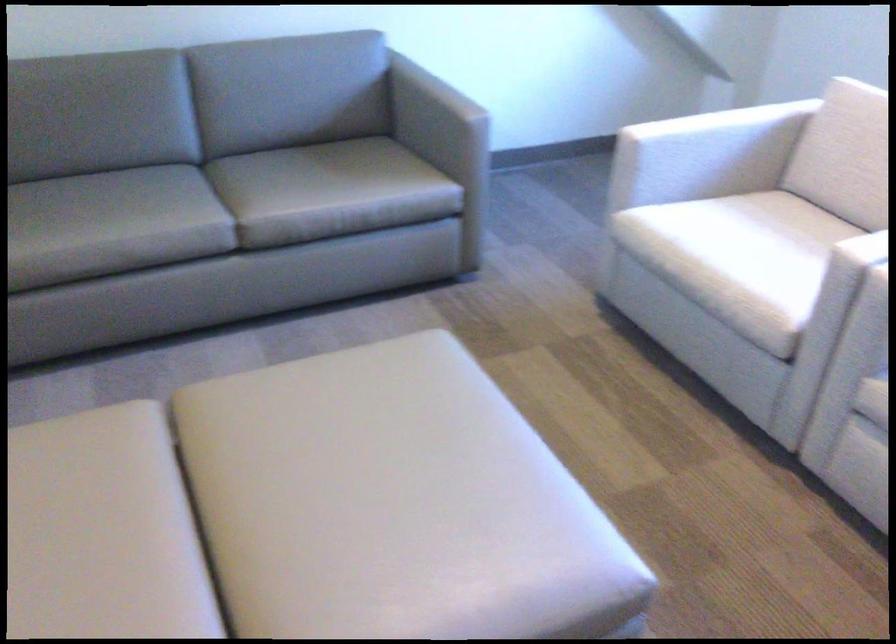
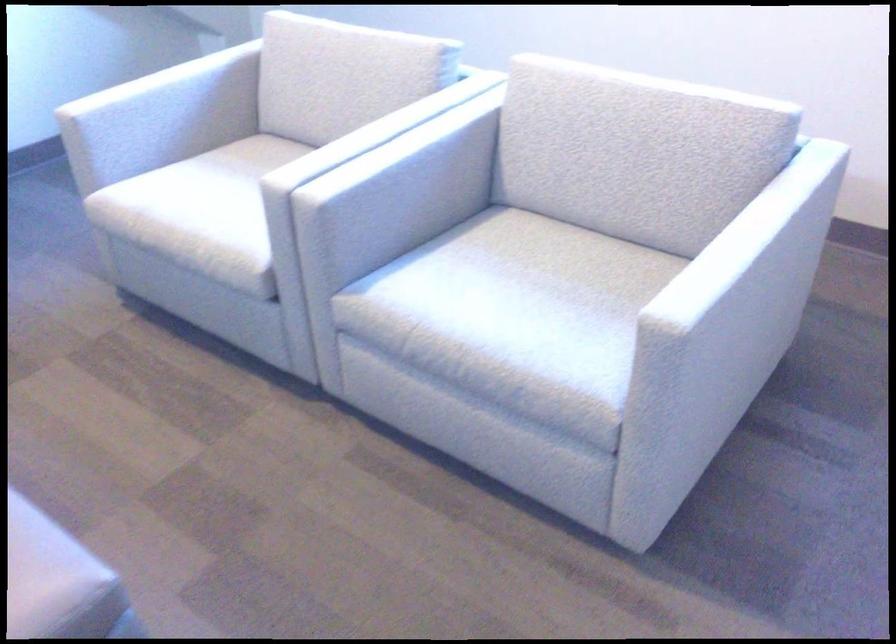
Question: The first image is from the beginning of the video and the second image is from the end. How did the camera likely rotate when shooting the video?

Choices:
 (A) Left
 (B) Right
 (C) Up
 (D) Down

Answer: (B)